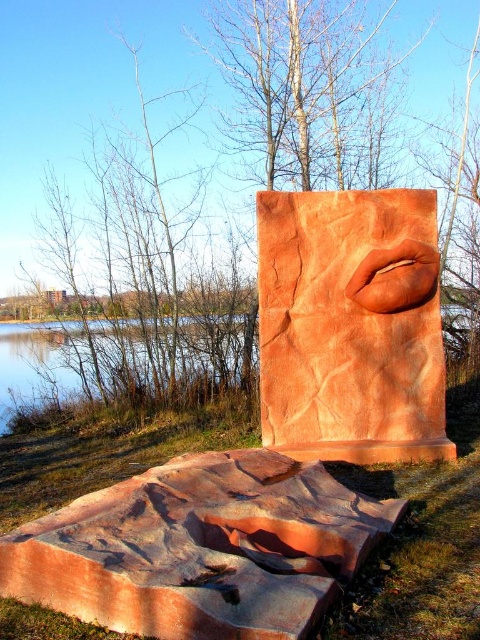
Question: Which object is the closest to the matte clay lips at center?

Choices:
 (A) clear water at lower left
 (B) brown wood tree at center

Answer: (A)

Question: Is brown wood tree at center positioned behind clear water at lower left?

Choices:
 (A) yes
 (B) no

Answer: (A)

Question: Based on their relative distances, which object is farther from the brown wood tree at center?

Choices:
 (A) clear water at lower left
 (B) matte clay lips at center

Answer: (B)

Question: Which object is positioned farthest from the matte clay lips at center?

Choices:
 (A) brown wood tree at center
 (B) clear water at lower left

Answer: (A)

Question: Does matte clay lips at center have a lesser width compared to clear water at lower left?

Choices:
 (A) no
 (B) yes

Answer: (B)

Question: From the image, what is the correct spatial relationship of brown wood tree at center in relation to clear water at lower left?

Choices:
 (A) below
 (B) above

Answer: (B)